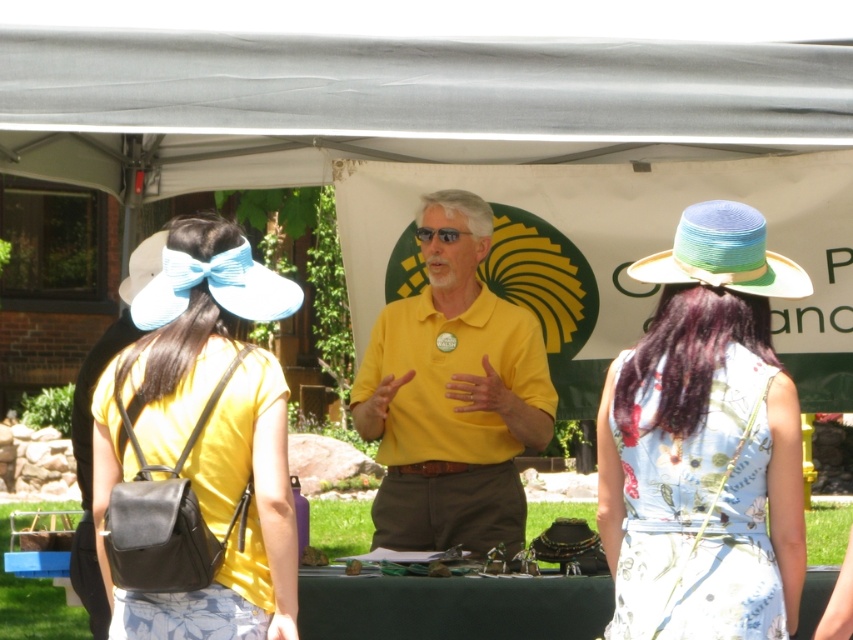
In the scene shown: Can you confirm if matte black backpack at left is positioned to the left of multicolored woven straw hat at upper right?

Correct, you'll find matte black backpack at left to the left of multicolored woven straw hat at upper right.

Who is taller, matte black backpack at left or multicolored woven straw hat at upper right?

Standing taller between the two is matte black backpack at left.

Does point (260, 484) come in front of point (701, 250)?

No, (260, 484) is further to viewer.

Where is `matte black backpack at left`? matte black backpack at left is located at coordinates (206, 435).

Can you confirm if matte black backpack at left is positioned above white fabric visor at upper left?

No, matte black backpack at left is not above white fabric visor at upper left.

Between matte black backpack at left and white fabric visor at upper left, which one has less height?

With less height is white fabric visor at upper left.

Is point (292, 509) farther from viewer compared to point (138, 262)?

No, (292, 509) is closer to viewer.

Where is `matte black backpack at left`? matte black backpack at left is located at coordinates [x=206, y=435].

Is light blue fabric visor at upper left further to the viewer compared to white fabric visor at upper left?

No, it is not.

Does light blue fabric visor at upper left have a larger size compared to white fabric visor at upper left?

Incorrect, light blue fabric visor at upper left is not larger than white fabric visor at upper left.

Does point (131, 305) lie in front of point (155, 252)?

Yes, it is in front of point (155, 252).

Locate an element on the screen. This screenshot has width=853, height=640. light blue fabric visor at upper left is located at coordinates (207, 284).